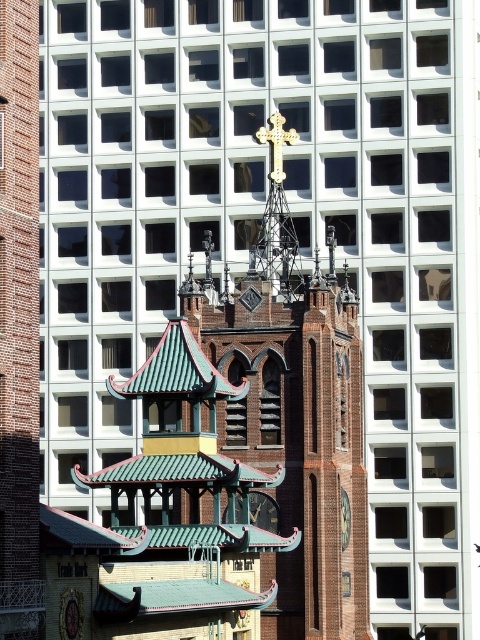
Question: Is gold metallic cross at center wider than gold metallic cross at upper center?

Choices:
 (A) yes
 (B) no

Answer: (A)

Question: Is gold metallic cross at upper center in front of gold metallic clock at center?

Choices:
 (A) yes
 (B) no

Answer: (B)

Question: Which is farther from the gold metallic cross at upper center?

Choices:
 (A) gold metallic clock at center
 (B) green wooden clock at center

Answer: (A)

Question: Estimate the real-world distances between objects in this image. Which object is farther from the gold metallic clock at center?

Choices:
 (A) green wooden clock at center
 (B) gold metallic cross at center

Answer: (B)

Question: Can you confirm if gold metallic cross at center is positioned to the right of gold metallic clock at center?

Choices:
 (A) no
 (B) yes

Answer: (B)

Question: Which point is farther to the camera?

Choices:
 (A) (344, 525)
 (B) (261, 502)
 (C) (274, 129)

Answer: (C)